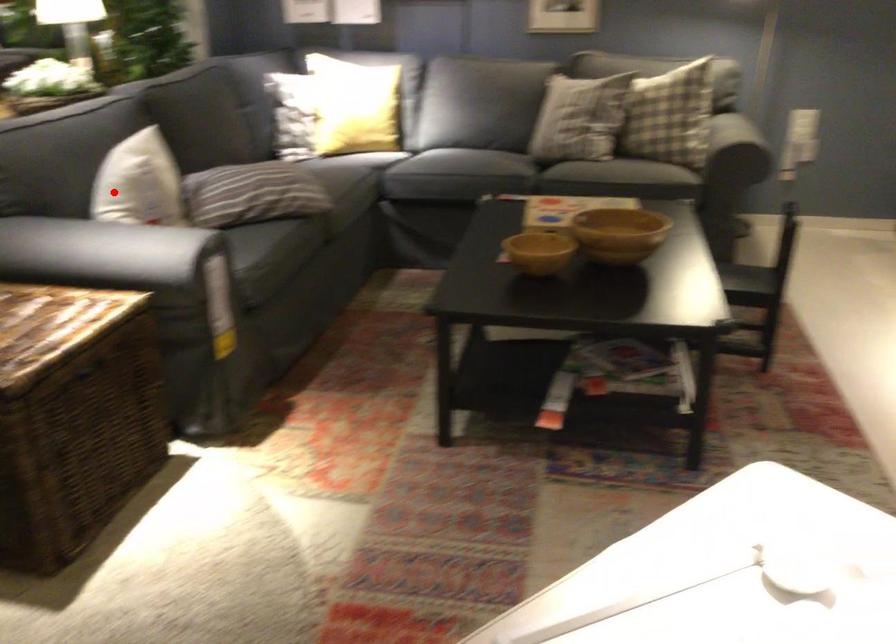
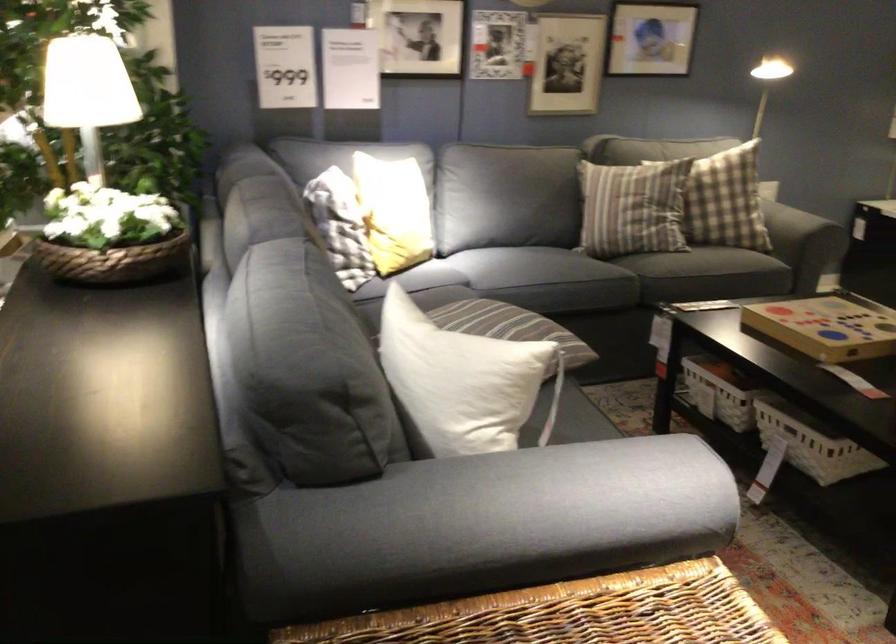
Question: I am providing you with two images of the same scene from different viewpoints. Given a red point in image1, look at the same physical point in image2. Is it:

Choices:
 (A) Closer to the viewpoint
 (B) Farther from the viewpoint

Answer: (A)